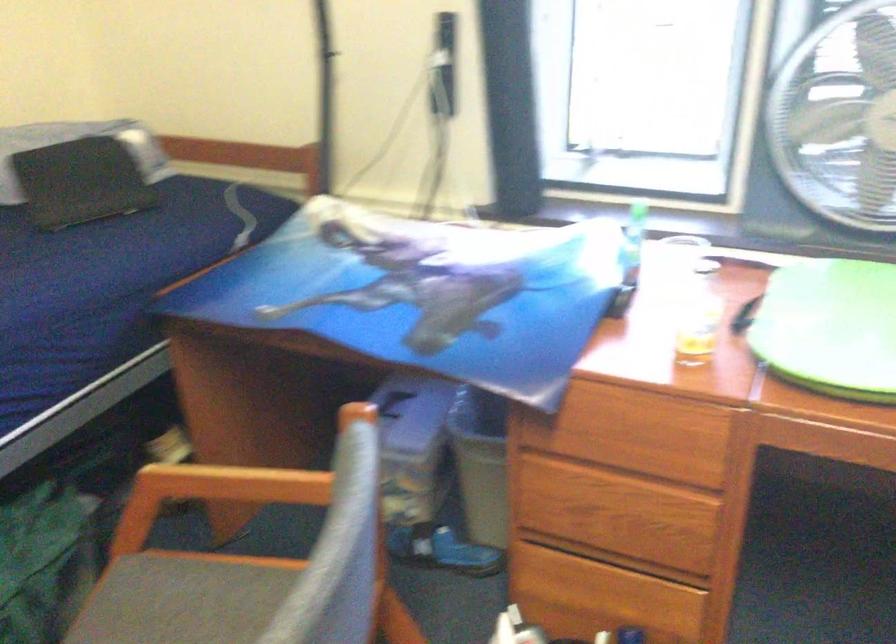
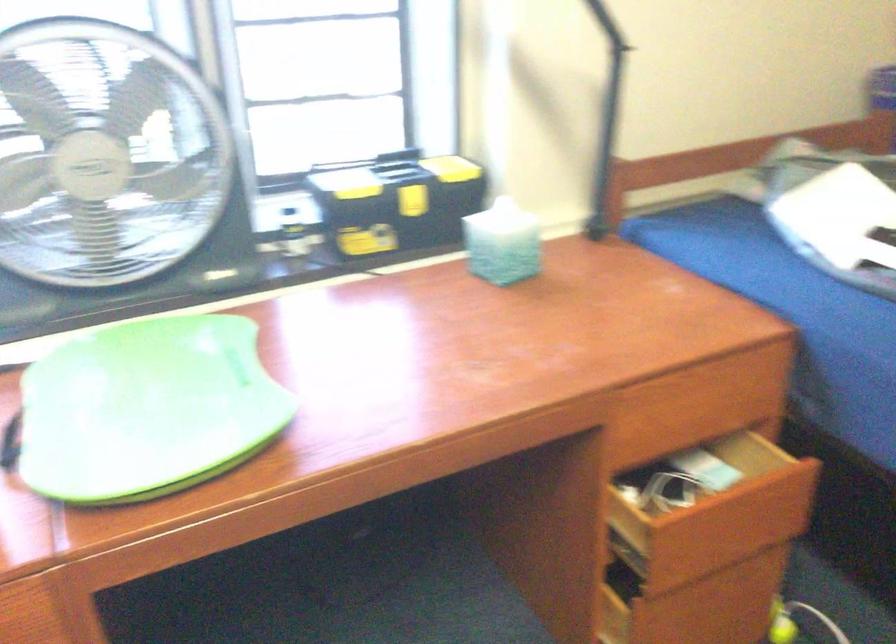
Question: The first image is from the beginning of the video and the second image is from the end. How did the camera likely rotate when shooting the video?

Choices:
 (A) Left
 (B) Right
 (C) Up
 (D) Down

Answer: (B)